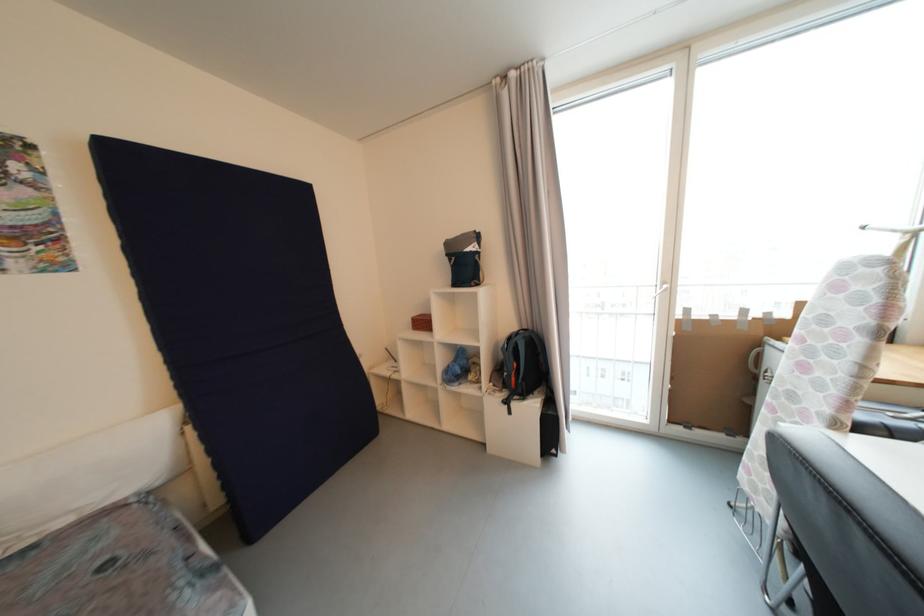
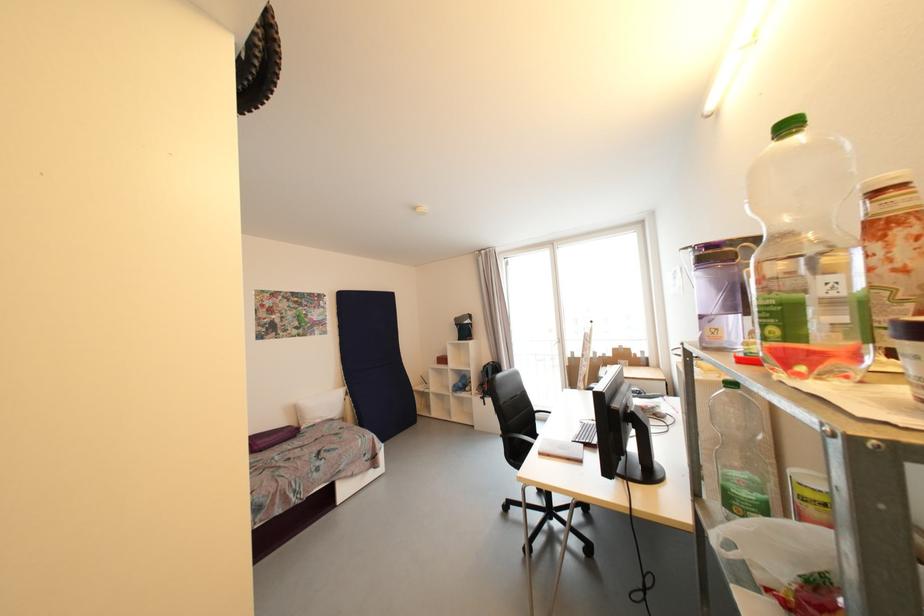
Where in the second image is the point corresponding to (515,341) from the first image?

(490, 368)